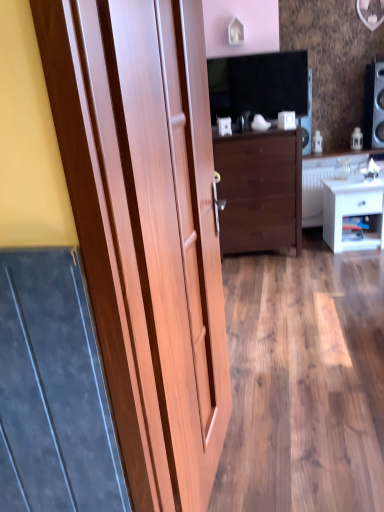
The height and width of the screenshot is (512, 384). What do you see at coordinates (353, 213) in the screenshot? I see `white glossy nightstand at lower right` at bounding box center [353, 213].

The width and height of the screenshot is (384, 512). Find the location of `wooden door at left`. wooden door at left is located at coordinates point(146,229).

You are a GUI agent. You are given a task and a screenshot of the screen. Output one action in this format:
    pyautogui.click(x=<x>, y=<y>)
    Task: Click on the dark wood chest of drawers at center
    The width and height of the screenshot is (384, 512).
    Given the screenshot: What is the action you would take?
    pyautogui.click(x=260, y=191)

Locate an element on the screen. black glossy speaker at upper right is located at coordinates (374, 106).

You are a GUI agent. You are given a task and a screenshot of the screen. Output one action in this format:
    pyautogui.click(x=<x>, y=<y>)
    Task: Click on the matte black tv at upper center
    
    Given the screenshot: What is the action you would take?
    pyautogui.click(x=259, y=84)

At what (x,y) coordinates should I click in order to perform the action: click on white glossy nightstand at lower right. Please return your answer as a coordinate pair (x, y). This screenshot has height=512, width=384. Looking at the image, I should click on (353, 213).

How many degrees apart are the facing directions of wooden door at left and white glossy nightstand at lower right?

There is a 76.3-degree angle between the facing directions of wooden door at left and white glossy nightstand at lower right.

Is wooden door at left facing away from white glossy nightstand at lower right?

No, white glossy nightstand at lower right is not at the back of wooden door at left.

The width and height of the screenshot is (384, 512). What are the coordinates of `nightstand behind the wooden door at left` in the screenshot? It's located at (353, 213).

Looking at this image, is white glossy counter top at center outside of wooden door at left?

Absolutely, white glossy counter top at center is external to wooden door at left.

Consider the image. From a real-world perspective, which is physically above, white glossy counter top at center or wooden door at left?

wooden door at left, from a real-world perspective.

Can you confirm if white glossy counter top at center is wider than wooden door at left?

Yes, white glossy counter top at center is wider than wooden door at left.

Is dark wood chest of drawers at center to the left of wooden door at left from the viewer's perspective?

No, dark wood chest of drawers at center is not to the left of wooden door at left.

From the image's perspective, is dark wood chest of drawers at center on top of wooden door at left?

Yes.

Considering the relative positions of dark wood chest of drawers at center and wooden door at left in the image provided, is dark wood chest of drawers at center in front of wooden door at left?

No, it is behind wooden door at left.

The width and height of the screenshot is (384, 512). I want to click on the chest of drawers lying above the wooden door at left (from the image's perspective), so coord(260,191).

Between white glossy nightstand at lower right and black glossy speaker at upper right, which one has smaller width?

With smaller width is black glossy speaker at upper right.

Which object is closer to the camera, white glossy nightstand at lower right or black glossy speaker at upper right?

white glossy nightstand at lower right.

Is point (368, 242) less distant than point (373, 92)?

Yes, it is in front of point (373, 92).

From a real-world perspective, which is physically above, white glossy nightstand at lower right or black glossy speaker at upper right?

From a 3D spatial view, black glossy speaker at upper right is above.

Is white glossy counter top at center turned away from matte black tv at upper center?

No, white glossy counter top at center's orientation is not away from matte black tv at upper center.

Who is shorter, white glossy counter top at center or matte black tv at upper center?

white glossy counter top at center.

From the image's perspective, is white glossy counter top at center beneath matte black tv at upper center?

Yes, from the image's perspective, white glossy counter top at center is below matte black tv at upper center.

From a real-world perspective, is white glossy nightstand at lower right above or below matte black tv at upper center?

From a real-world perspective, white glossy nightstand at lower right is physically below matte black tv at upper center.

Find the location of a particular element. This screenshot has height=512, width=384. nightstand on the right of matte black tv at upper center is located at coordinates (353, 213).

Does point (383, 210) appear closer or farther from the camera than point (258, 100)?

Point (383, 210) appears to be farther away from the viewer than point (258, 100).

From the image's perspective, between white glossy nightstand at lower right and matte black tv at upper center, who is located below?

white glossy nightstand at lower right, from the image's perspective.

Is wooden door at left not close to matte black tv at upper center?

Yes.

From a real-world perspective, is wooden door at left physically below matte black tv at upper center?

Yes.

You are a GUI agent. You are given a task and a screenshot of the screen. Output one action in this format:
    pyautogui.click(x=<x>, y=<y>)
    Task: Click on the door located in front of the white glossy nightstand at lower right
    The height and width of the screenshot is (512, 384).
    Given the screenshot: What is the action you would take?
    pyautogui.click(x=146, y=229)

This screenshot has height=512, width=384. Identify the location of counter top below the wooden door at left (from a real-world perspective). (344, 155).

Estimate the real-world distances between objects in this image. Which object is further from white glossy nightstand at lower right, dark wood chest of drawers at center or matte black tv at upper center?

Among the two, matte black tv at upper center is located further to white glossy nightstand at lower right.

When comparing their distances from white glossy nightstand at lower right, does matte black tv at upper center or white glossy counter top at center seem closer?

The object closer to white glossy nightstand at lower right is white glossy counter top at center.

Estimate the real-world distances between objects in this image. Which object is further from matte black tv at upper center, white glossy nightstand at lower right or white glossy counter top at center?

The object further to matte black tv at upper center is white glossy nightstand at lower right.

When comparing their distances from wooden door at left, does white glossy nightstand at lower right or dark wood chest of drawers at center seem closer?

dark wood chest of drawers at center.

From the image, which object appears to be nearer to matte black tv at upper center, wooden door at left or white glossy counter top at center?

white glossy counter top at center.

Considering their positions, is wooden door at left positioned further to white glossy counter top at center than black glossy speaker at upper right?

Among the two, wooden door at left is located further to white glossy counter top at center.

Estimate the real-world distances between objects in this image. Which object is further from black glossy speaker at upper right, wooden door at left or dark wood chest of drawers at center?

Based on the image, wooden door at left appears to be further to black glossy speaker at upper right.

When comparing their distances from wooden door at left, does white glossy nightstand at lower right or black glossy speaker at upper right seem further?

black glossy speaker at upper right.

Where is `counter top between black glossy speaker at upper right and white glossy nightstand at lower right in the vertical direction`? The height and width of the screenshot is (512, 384). counter top between black glossy speaker at upper right and white glossy nightstand at lower right in the vertical direction is located at coordinates (344, 155).

The image size is (384, 512). Identify the location of dark between wooden door at left and black glossy speaker at upper right in the front-back direction. (259, 84).

Find the location of a particular element. nightstand located between wooden door at left and white glossy counter top at center in the depth direction is located at coordinates (353, 213).

I want to click on chest of drawers between wooden door at left and white glossy counter top at center in the front-back direction, so click(x=260, y=191).